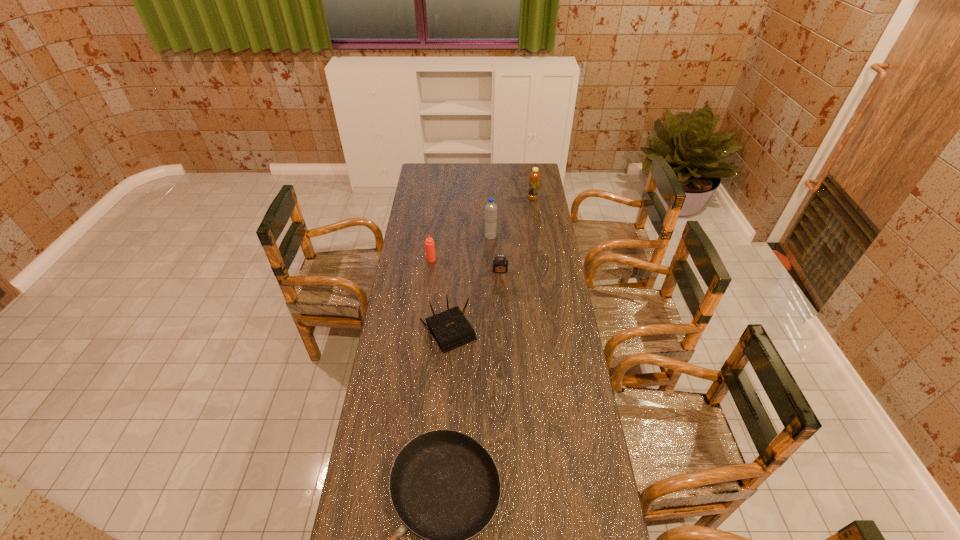
Where is `free space that satisfies the following two spatial constraints: 1. on the back side of the bottle; 2. on the left side of the router`? This screenshot has height=540, width=960. free space that satisfies the following two spatial constraints: 1. on the back side of the bottle; 2. on the left side of the router is located at coordinates (458, 199).